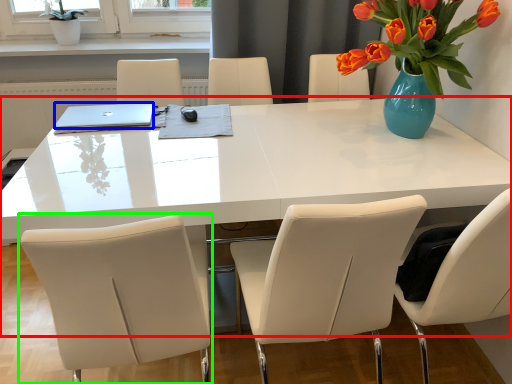
Question: Which is farther away from table (highlighted by a red box)? laptop (highlighted by a blue box) or chair (highlighted by a green box)?

Choices:
 (A) laptop
 (B) chair

Answer: (A)